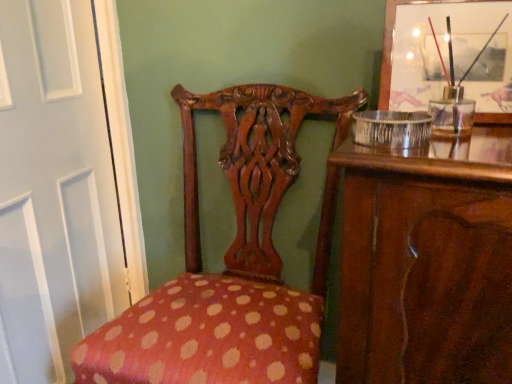
Where is `white glossy door at left`? white glossy door at left is located at coordinates (54, 190).

This screenshot has height=384, width=512. What do you see at coordinates (447, 55) in the screenshot? I see `wooden picture frame at upper right` at bounding box center [447, 55].

Where is `white glossy door at left`? white glossy door at left is located at coordinates (54, 190).

Can you confirm if white glossy door at left is smaller than wooden picture frame at upper right?

Incorrect, white glossy door at left is not smaller in size than wooden picture frame at upper right.

Does white glossy door at left contain wooden picture frame at upper right?

Actually, wooden picture frame at upper right is outside white glossy door at left.

From a real-world perspective, who is located lower, white glossy door at left or wooden picture frame at upper right?

white glossy door at left, from a real-world perspective.

Considering the points (37, 36) and (510, 104), which point is in front, point (37, 36) or point (510, 104)?

The point (510, 104) is closer.

Based on the photo, from the image's perspective, which one is positioned higher, polka dot fabric chair at center or white glossy door at left?

white glossy door at left appears higher in the image.

Does polka dot fabric chair at center have a greater height compared to white glossy door at left?

Incorrect, the height of polka dot fabric chair at center is not larger of that of white glossy door at left.

Would you consider polka dot fabric chair at center to be distant from white glossy door at left?

That's not correct — polka dot fabric chair at center is a little close to white glossy door at left.

I want to click on chair below the wooden picture frame at upper right (from a real-world perspective), so click(231, 261).

Is wooden picture frame at upper right not close to polka dot fabric chair at center?

No.

Is wooden picture frame at upper right aimed at polka dot fabric chair at center?

No, wooden picture frame at upper right is not aimed at polka dot fabric chair at center.

Would you say polka dot fabric chair at center is a long distance from wooden picture frame at upper right?

No.

From a real-world perspective, which object stands above the other?

wooden picture frame at upper right, from a real-world perspective.

Can you confirm if polka dot fabric chair at center is taller than wooden picture frame at upper right?

Indeed, polka dot fabric chair at center has a greater height compared to wooden picture frame at upper right.

Is point (158, 292) positioned after point (420, 18)?

That is True.

Locate an element on the screen. The height and width of the screenshot is (384, 512). screen door above the polka dot fabric chair at center (from the image's perspective) is located at coordinates (54, 190).

Does white glossy door at left appear on the right side of polka dot fabric chair at center?

No.

Which of these two, white glossy door at left or polka dot fabric chair at center, is smaller?

white glossy door at left.

Consider the image. Does white glossy door at left come behind polka dot fabric chair at center?

Yes, it is behind polka dot fabric chair at center.

Is point (443, 29) positioned before point (79, 247)?

Yes.

Would you say wooden picture frame at upper right is inside or outside white glossy door at left?

The correct answer is: outside.

Considering the relative sizes of wooden picture frame at upper right and white glossy door at left in the image provided, is wooden picture frame at upper right bigger than white glossy door at left?

No, wooden picture frame at upper right is not bigger than white glossy door at left.

From a real-world perspective, between wooden picture frame at upper right and white glossy door at left, who is vertically lower?

In real-world perspective, white glossy door at left is lower.

Where is `picture frame above the white glossy door at left (from a real-world perspective)`? The image size is (512, 384). picture frame above the white glossy door at left (from a real-world perspective) is located at coordinates pyautogui.click(x=447, y=55).

At what (x,y) coordinates should I click in order to perform the action: click on chair below the white glossy door at left (from the image's perspective). Please return your answer as a coordinate pair (x, y). The height and width of the screenshot is (384, 512). Looking at the image, I should click on (231, 261).

When comparing their distances from white glossy door at left, does polka dot fabric chair at center or wooden picture frame at upper right seem closer?

polka dot fabric chair at center.

When comparing their distances from polka dot fabric chair at center, does white glossy door at left or wooden picture frame at upper right seem further?

wooden picture frame at upper right is positioned further to the anchor polka dot fabric chair at center.

Looking at the image, which one is located further to white glossy door at left, wooden picture frame at upper right or polka dot fabric chair at center?

wooden picture frame at upper right lies further to white glossy door at left than the other object.

Looking at the image, which one is located further to wooden picture frame at upper right, white glossy door at left or polka dot fabric chair at center?

white glossy door at left is further to wooden picture frame at upper right.

Estimate the real-world distances between objects in this image. Which object is further from polka dot fabric chair at center, wooden picture frame at upper right or white glossy door at left?

wooden picture frame at upper right is further to polka dot fabric chair at center.

Estimate the real-world distances between objects in this image. Which object is closer to wooden picture frame at upper right, polka dot fabric chair at center or white glossy door at left?

Among the two, polka dot fabric chair at center is located nearer to wooden picture frame at upper right.

At what (x,y) coordinates should I click in order to perform the action: click on chair between white glossy door at left and wooden picture frame at upper right from left to right. Please return your answer as a coordinate pair (x, y). Looking at the image, I should click on (231, 261).